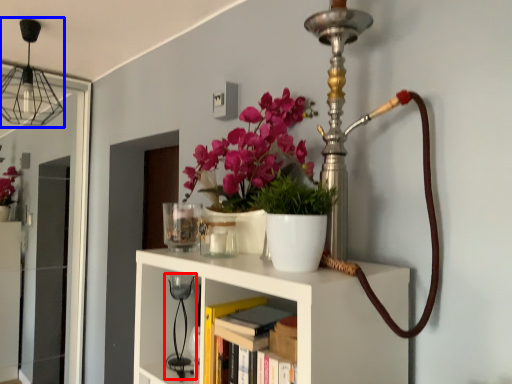
Question: Which point is closer to the camera, table lamp (highlighted by a red box) or lamp (highlighted by a blue box)?

Choices:
 (A) table lamp
 (B) lamp

Answer: (A)